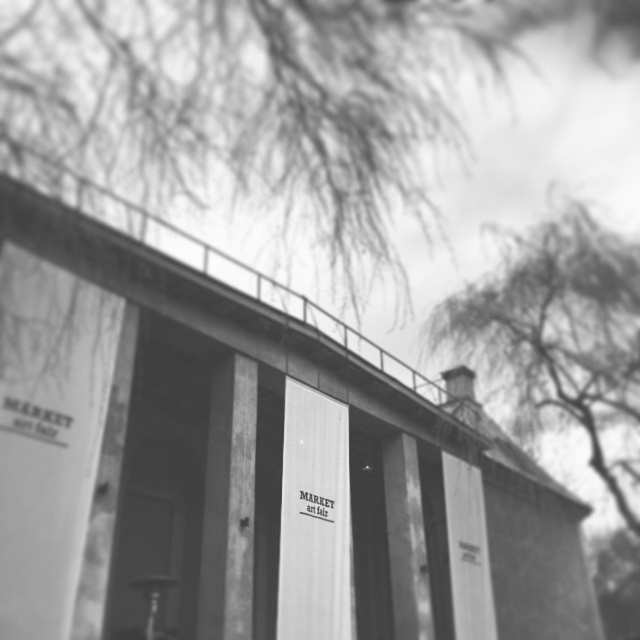
Question: Considering the relative positions of smooth concrete bridge at center and thin branches at upper right in the image provided, where is smooth concrete bridge at center located with respect to thin branches at upper right?

Choices:
 (A) right
 (B) left

Answer: (B)

Question: Is smooth concrete bridge at center wider than thin branches at upper right?

Choices:
 (A) yes
 (B) no

Answer: (A)

Question: Among these objects, which one is nearest to the camera?

Choices:
 (A) thin branches at upper right
 (B) smooth concrete bridge at center

Answer: (B)

Question: From the image, what is the correct spatial relationship of smooth concrete bridge at center in relation to thin branches at upper right?

Choices:
 (A) below
 (B) above

Answer: (A)

Question: Which of the following is the closest to the observer?

Choices:
 (A) smooth concrete bridge at center
 (B) thin branches at upper right

Answer: (A)